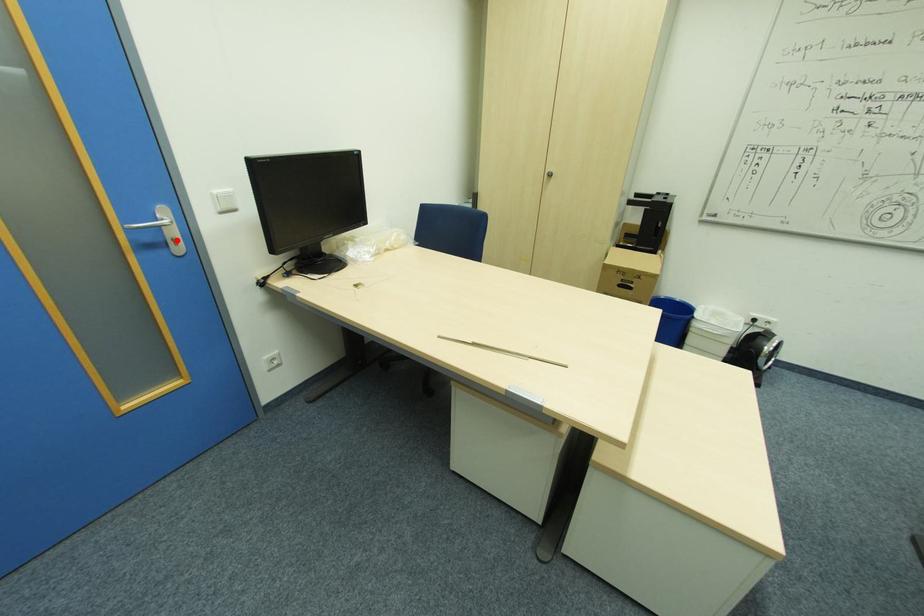
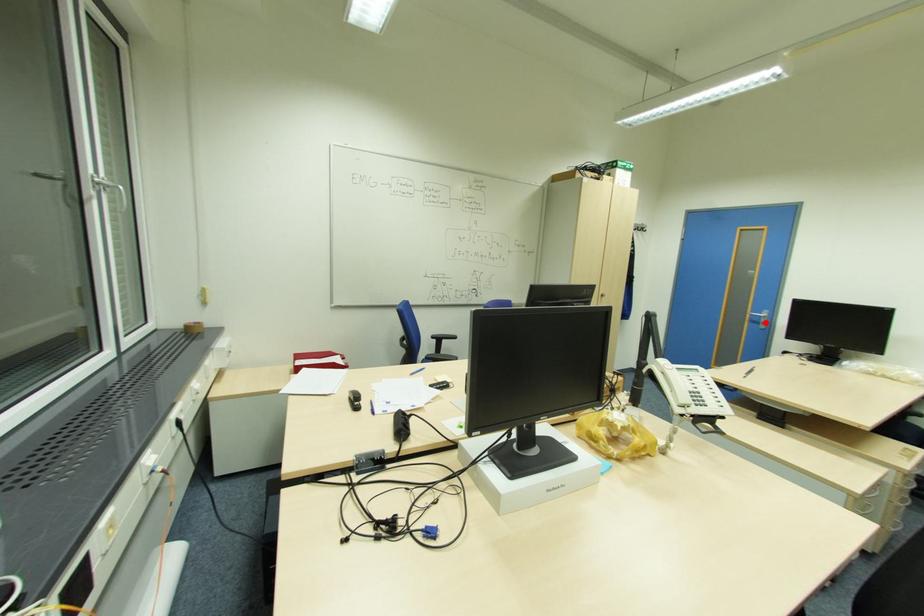
I am providing you with two images of the same scene from different viewpoints. A red point is marked on the first image and another point is marked on the second image. Is the red point in image1 aligned with the point shown in image2?

Yes